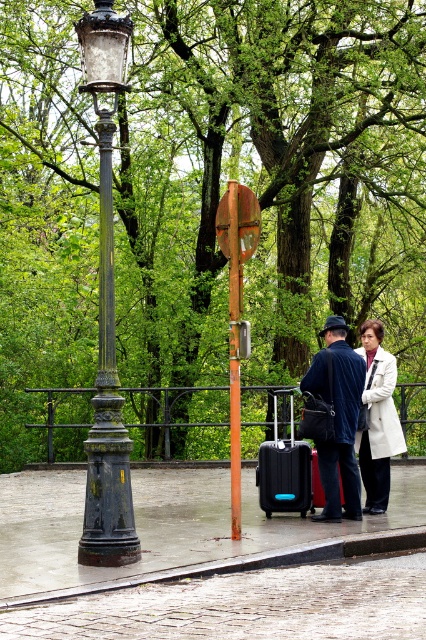
You are a delivery person who needs to place both the dark blue fabric coat at center and the black hard suitcase at center into a storage locker. The locker has a maximum weight capacity of 20 kilograms. If the combined weight of both items is 18 kilograms, can you safely store them together?

The combined weight of the dark blue fabric coat at center and the black hard suitcase at center is 18 kilograms, which is under the locker maximum capacity of 20 kilograms. Yes, you can safely store them together.

You are a delivery person trying to navigate to a specific location in the park. You see the black polished metal streetlamp at left and the rusted orange pole with a circular sign in the center. According to the coordinates provided, which object is closer to the point of interest at point (106, 317)?

The black polished metal streetlamp at left is located at point (106, 317), so it is exactly at the point of interest.